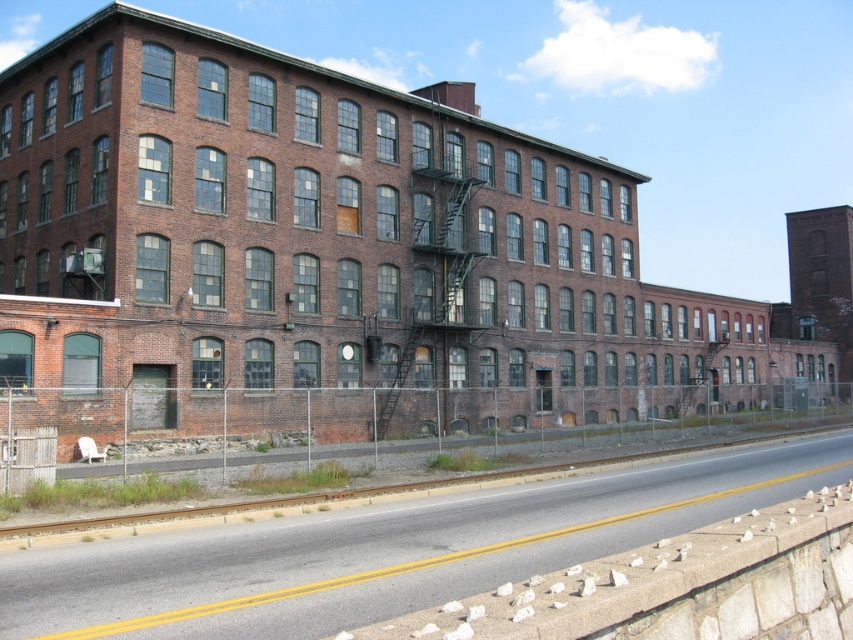
Consider the image. Between brick building at center and smooth asphalt train track at lower center, which one is positioned lower?

smooth asphalt train track at lower center is lower down.

Is point (561, 416) in front of point (726, 499)?

No.

Where is `brick building at center`? brick building at center is located at coordinates (328, 253).